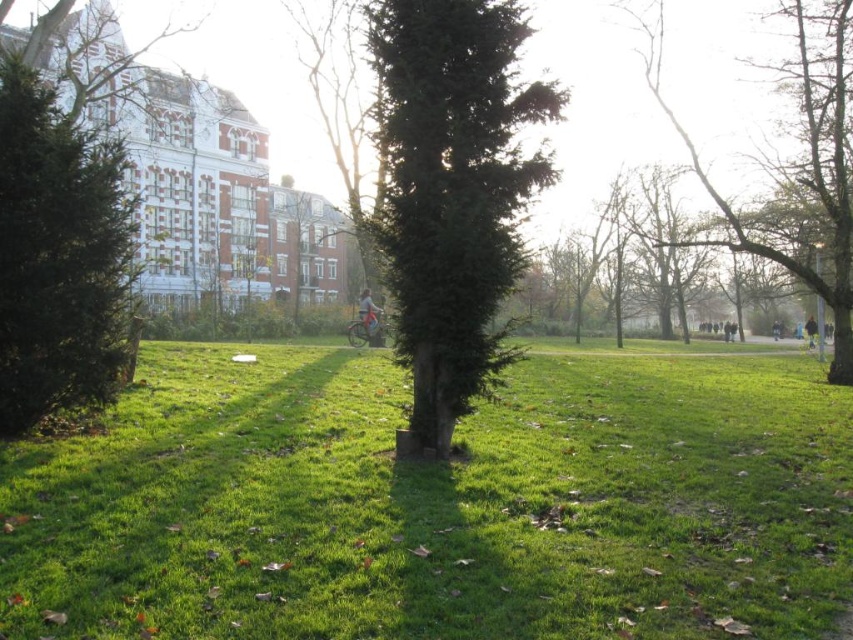
Question: Considering the real-world distances, which object is farthest from the green textured tree at left?

Choices:
 (A) bare branches tree at upper right
 (B) dark blue jacket at right
 (C) light blue fabric jacket at center

Answer: (B)

Question: Is green textured tree at center to the right of bare branches tree at upper right from the viewer's perspective?

Choices:
 (A) yes
 (B) no

Answer: (B)

Question: Does green grassy at center come behind green textured tree at left?

Choices:
 (A) no
 (B) yes

Answer: (A)

Question: Is bare branches tree at upper right below dark gray jacket at center?

Choices:
 (A) yes
 (B) no

Answer: (B)

Question: Which of the following is the closest to the observer?

Choices:
 (A) (788, 225)
 (B) (782, 461)
 (C) (22, 188)
 (D) (811, 320)

Answer: (C)

Question: Which point is closer to the camera taking this photo?

Choices:
 (A) (106, 296)
 (B) (785, 196)
 (C) (813, 321)
 (D) (370, 333)

Answer: (A)